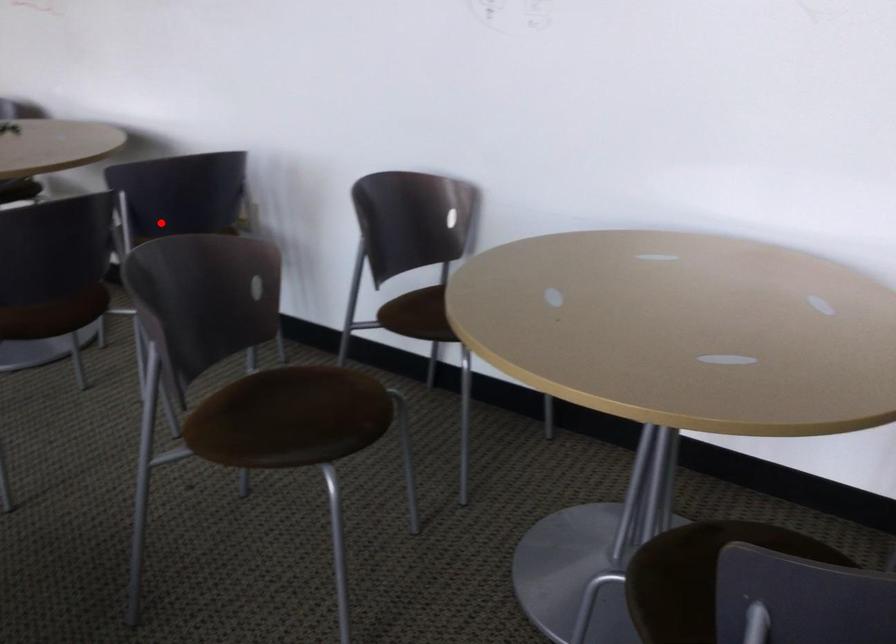
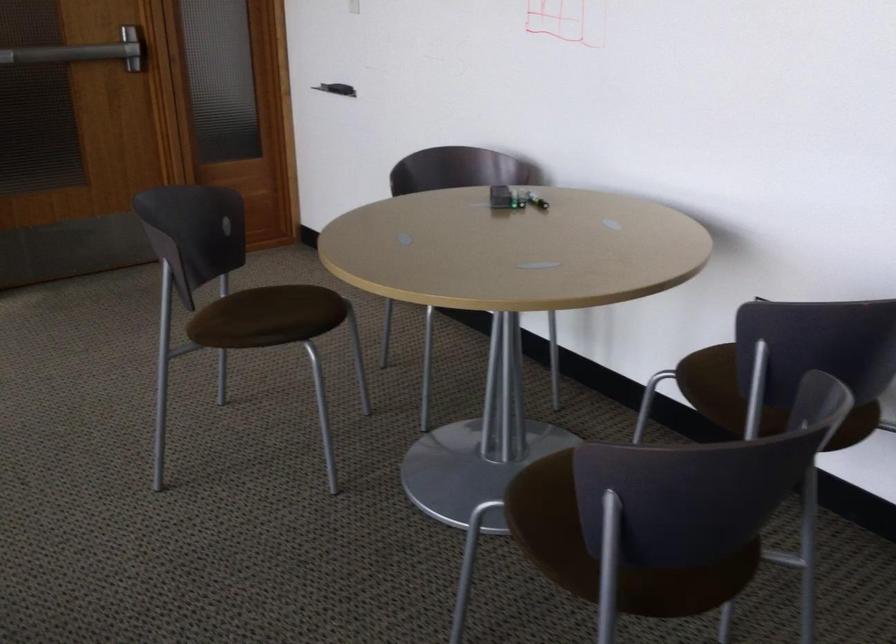
Where in the second image is the point corresponding to the highlighted location from the first image?

(745, 386)